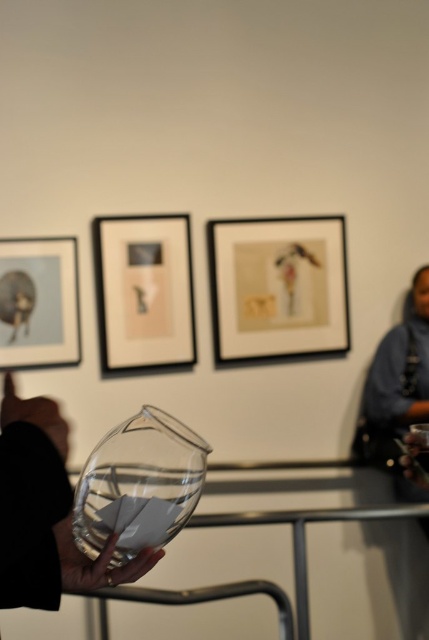
Does matte paper picture frame at center appear on the left side of matte glass picture frame at upper left?

No, matte paper picture frame at center is not to the left of matte glass picture frame at upper left.

Is point (254, 266) more distant than point (17, 289)?

Yes, it is.

Is point (287, 346) positioned behind point (60, 332)?

Yes, it is behind point (60, 332).

You are a GUI agent. You are given a task and a screenshot of the screen. Output one action in this format:
    pyautogui.click(x=<x>, y=<y>)
    Task: Click on the matte paper picture frame at center
    The width and height of the screenshot is (429, 640).
    Given the screenshot: What is the action you would take?
    pyautogui.click(x=277, y=289)

Does point (172, 532) come closer to viewer compared to point (45, 268)?

Yes, point (172, 532) is in front of point (45, 268).

Does transparent glass vase at center have a lesser width compared to matte glass picture frame at upper left?

No, transparent glass vase at center is not thinner than matte glass picture frame at upper left.

Measure the distance between point (166,461) and camera.

The distance of point (166,461) from camera is 11.87 inches.

In order to click on transparent glass vase at center in this screenshot , I will do `click(138, 484)`.

Does matte black picture frame at upper center appear on the left side of transparent glass vase at center?

Yes, matte black picture frame at upper center is to the left of transparent glass vase at center.

From the picture: Can you confirm if matte black picture frame at upper center is positioned below transparent glass vase at center?

No.

Who is more forward, [105,346] or [102,506]?

Point [102,506] is more forward.

Find the location of a particular element. matte black picture frame at upper center is located at coordinates (144, 292).